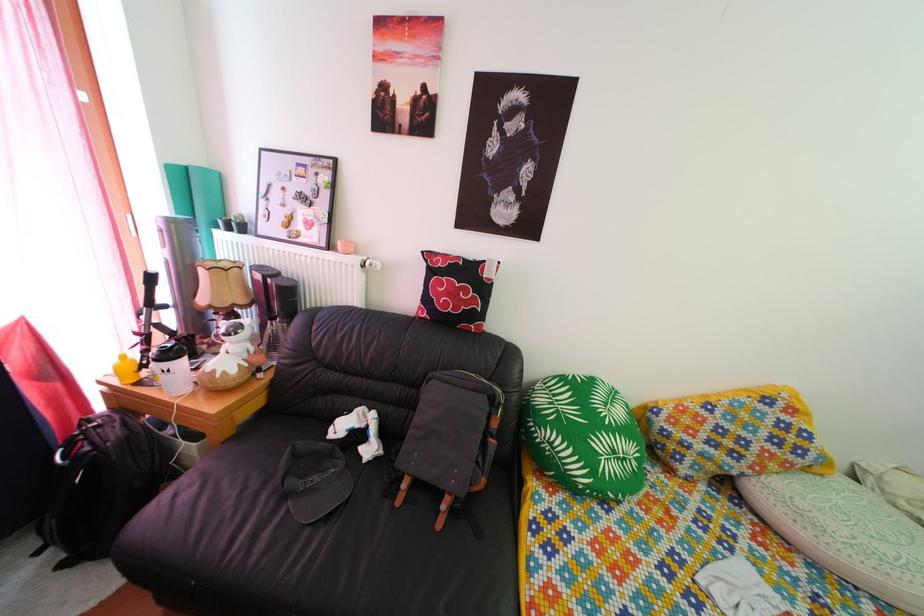
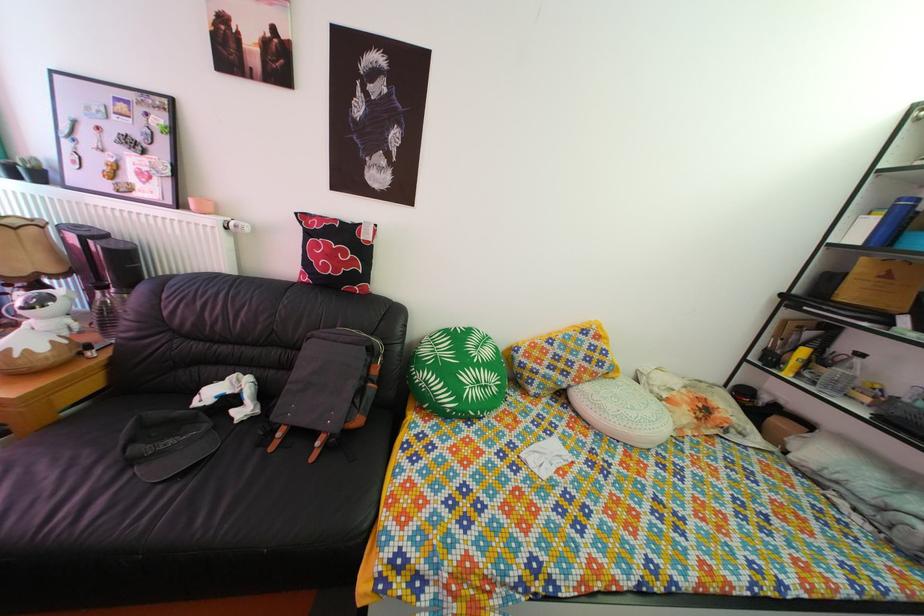
The point at (711, 416) is marked in the first image. Where is the corresponding point in the second image?

(555, 351)